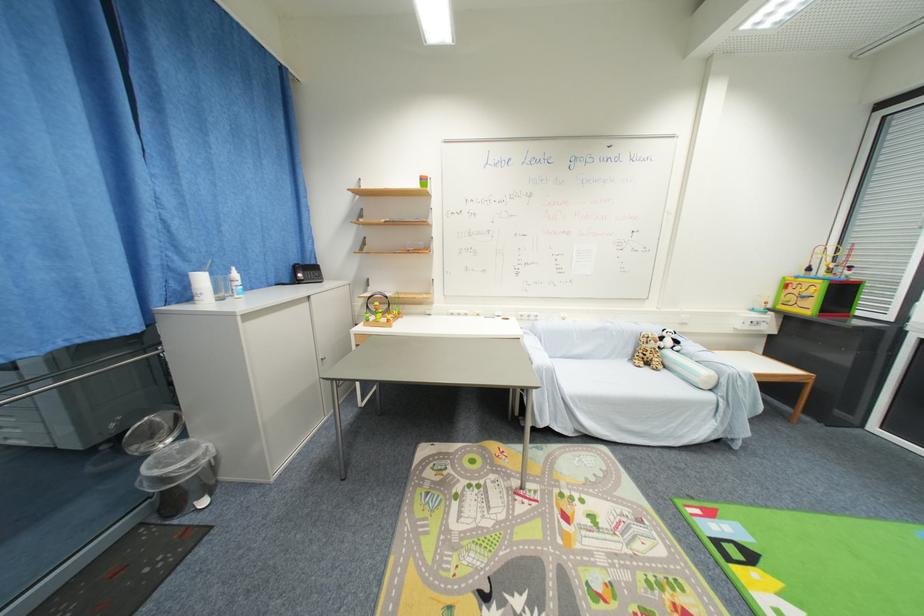
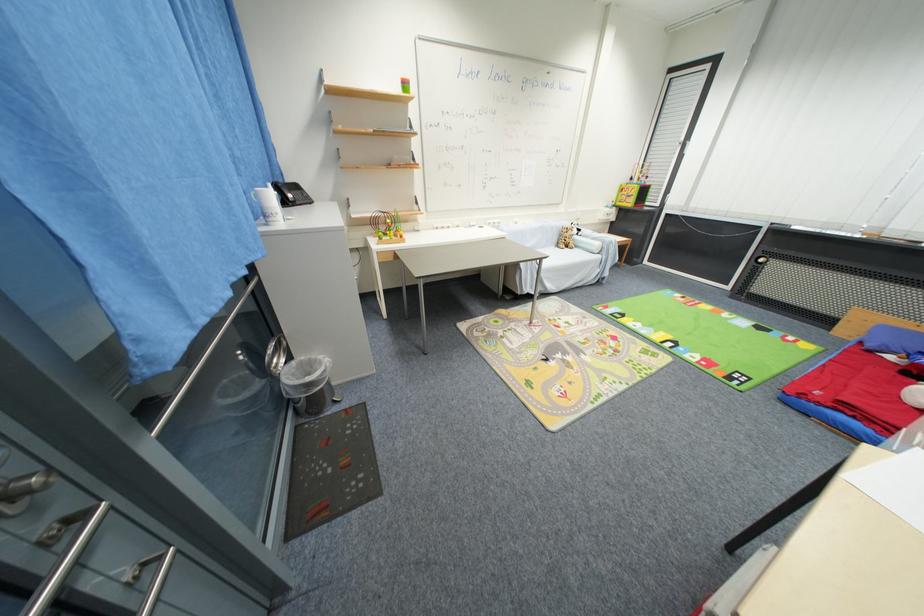
Where in the second image is the point corresponding to the point at 651,371 from the first image?

(572, 251)